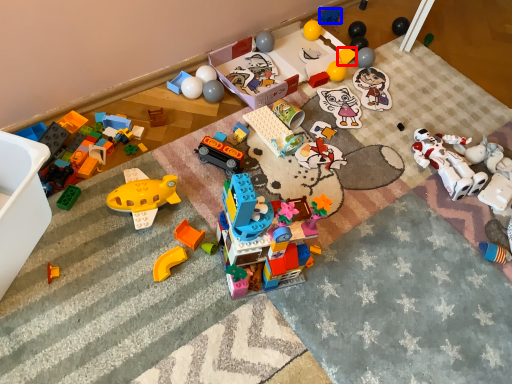
Question: Among these objects, which one is nearest to the camera, toy (highlighted by a red box) or toy (highlighted by a blue box)?

Choices:
 (A) toy
 (B) toy

Answer: (A)